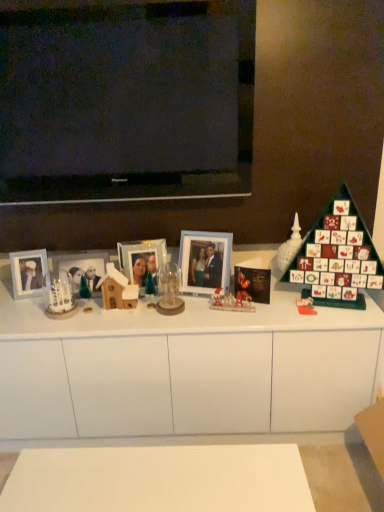
The width and height of the screenshot is (384, 512). I want to click on empty space that is in between white glossy advent calendar at right, which is counted as the 2th toy, starting from the right, and matte plastic toy at right, arranged as the first toy when viewed from the right, so click(292, 298).